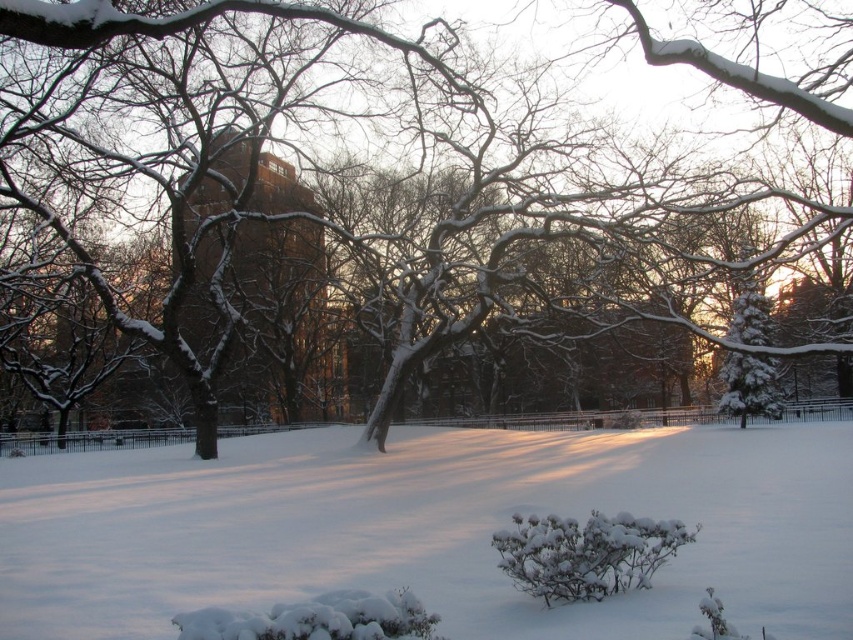
Question: Can you confirm if white fluffy snow at center is bigger than snow-covered branches at center?

Choices:
 (A) no
 (B) yes

Answer: (A)

Question: Can you confirm if white fluffy snow at center is wider than snow-covered branches at center?

Choices:
 (A) no
 (B) yes

Answer: (B)

Question: Which object appears farthest from the camera in this image?

Choices:
 (A) white fluffy snow at center
 (B) snow-covered branches at center

Answer: (A)

Question: Which point appears farthest from the camera in this image?

Choices:
 (A) (347, 22)
 (B) (828, 602)

Answer: (A)

Question: Does white fluffy snow at center appear on the right side of snow-covered branches at center?

Choices:
 (A) no
 (B) yes

Answer: (B)